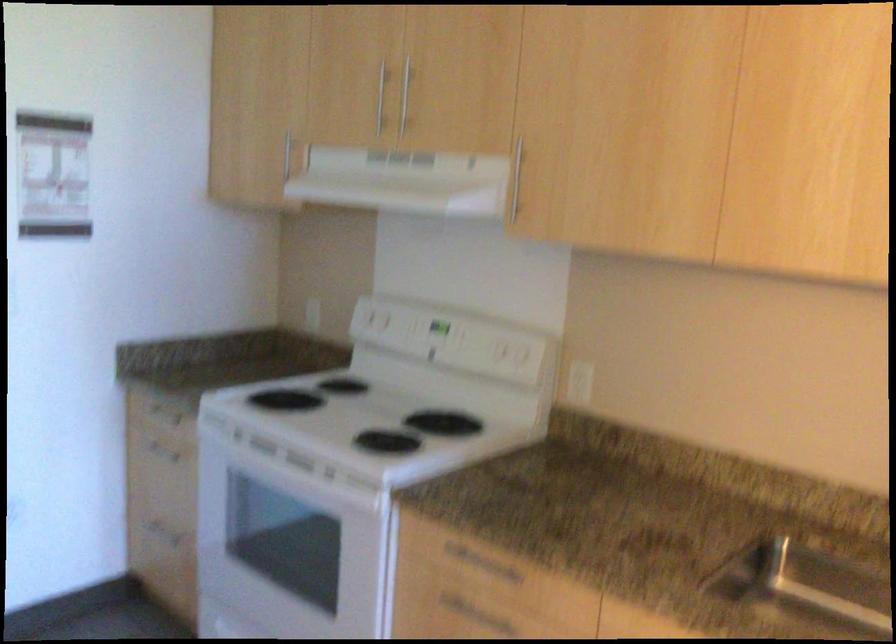
This screenshot has height=644, width=896. What do you see at coordinates (367, 415) in the screenshot? I see `a white stove dial` at bounding box center [367, 415].